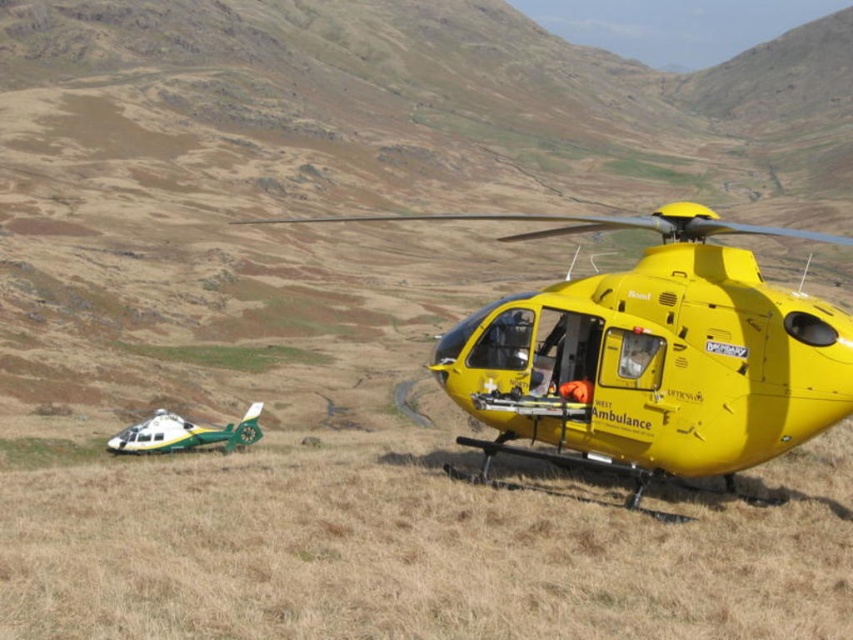
Which is more to the right, green matte helicopter at lower left or green grassy field at lower left?

green matte helicopter at lower left

Who is more distant from viewer, (x=169, y=445) or (x=154, y=353)?

Point (x=154, y=353)

Where is `green matte helicopter at lower left`? The width and height of the screenshot is (853, 640). green matte helicopter at lower left is located at coordinates (184, 433).

Who is more forward, (753, 368) or (164, 356)?

Point (753, 368) is more forward.

What do you see at coordinates (648, 355) in the screenshot? The width and height of the screenshot is (853, 640). I see `yellow matte helicopter at center` at bounding box center [648, 355].

At what (x,y) coordinates should I click in order to perform the action: click on yellow matte helicopter at center. Please return your answer as a coordinate pair (x, y). The width and height of the screenshot is (853, 640). Looking at the image, I should click on (648, 355).

Is yellow matte helicopter at center positioned in front of green matte helicopter at lower left?

Yes, yellow matte helicopter at center is closer to the viewer.

Is yellow matte helicopter at center positioned behind green matte helicopter at lower left?

No.

The image size is (853, 640). What do you see at coordinates (648, 355) in the screenshot? I see `yellow matte helicopter at center` at bounding box center [648, 355].

Where is `yellow matte helicopter at center`? yellow matte helicopter at center is located at coordinates (648, 355).